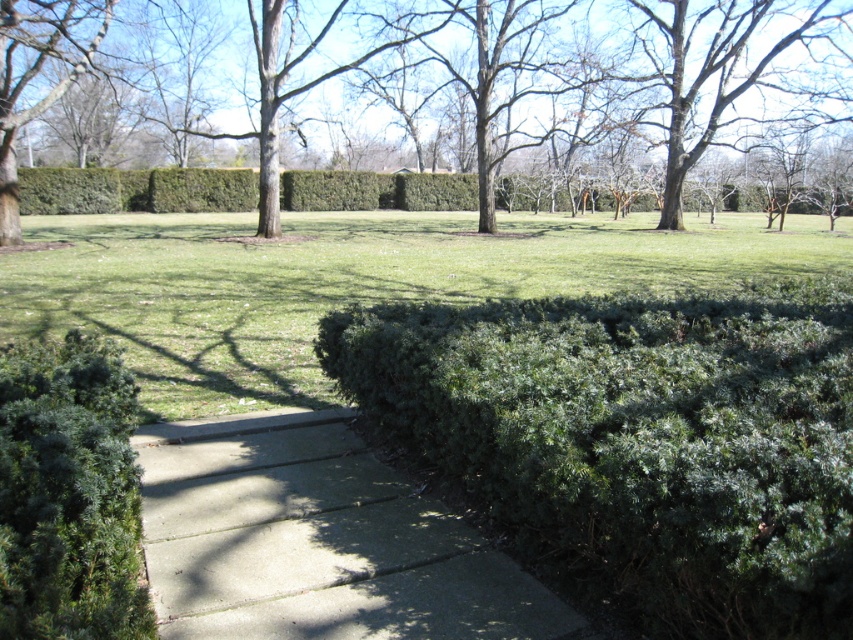
You are a landscape architect designing a new park layout. You need to place a bench between the brown textured tree at upper center and the green leafy tree at upper left. Considering their widths, which tree should the bench be closer to and why?

The bench should be closer to the brown textured tree at upper center because its width is larger than the green leafy tree at upper left, providing more space for the bench to be placed comfortably.

You are standing at the point marked as point [396,541] in the image. There is a concrete slab pathway leading towards the center. If you walk straight ahead, will you reach the grassy area before the trees?

Yes, because the distance from point [396,541] to the grass is 2.97 meters, which is shorter than the distance to the trees.

You are a landscape architect designing a new pathway. You need to ensure that the concrete at center is at least 20 meters away from the brown textured tree at upper center for proper drainage. Based on the image, does the current placement meet this requirement?

The concrete at center is 21.09 meters from the brown textured tree at upper center, which exceeds the required 20 meters, so the current placement meets the requirement.